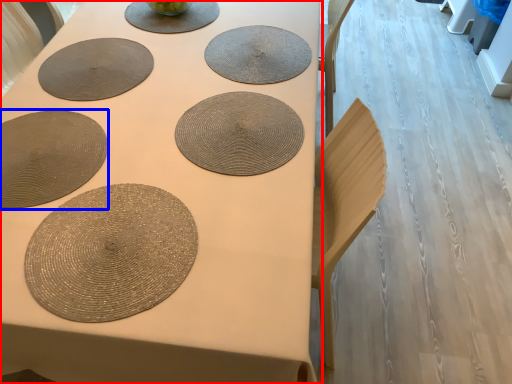
Question: Which object is closer to the camera taking this photo, table (highlighted by a red box) or paper plate (highlighted by a blue box)?

Choices:
 (A) table
 (B) paper plate

Answer: (A)